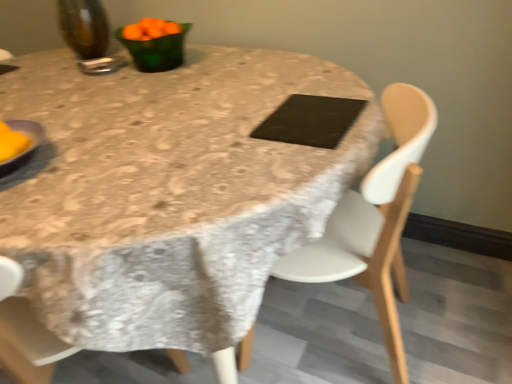
Question: From a real-world perspective, is black matte pad at center located beneath yellow matte plate at left?

Choices:
 (A) no
 (B) yes

Answer: (B)

Question: Could you tell me if black matte pad at center is turned towards yellow matte plate at left?

Choices:
 (A) yes
 (B) no

Answer: (B)

Question: Does black matte pad at center have a greater height compared to yellow matte plate at left?

Choices:
 (A) no
 (B) yes

Answer: (A)

Question: From the image's perspective, is black matte pad at center on yellow matte plate at left?

Choices:
 (A) no
 (B) yes

Answer: (B)

Question: Is black matte pad at center located outside yellow matte plate at left?

Choices:
 (A) yes
 (B) no

Answer: (A)

Question: Is black matte pad at center situated inside linen tablecloth at center or outside?

Choices:
 (A) outside
 (B) inside

Answer: (B)

Question: Is black matte pad at center bigger or smaller than linen tablecloth at center?

Choices:
 (A) big
 (B) small

Answer: (B)

Question: From the image's perspective, is black matte pad at center positioned above or below linen tablecloth at center?

Choices:
 (A) above
 (B) below

Answer: (A)

Question: Is point (357, 100) positioned closer to the camera than point (31, 69)?

Choices:
 (A) closer
 (B) farther

Answer: (A)

Question: Is yellow matte plate at left spatially inside white plastic chair at center, or outside of it?

Choices:
 (A) inside
 (B) outside

Answer: (B)

Question: Would you say yellow matte plate at left is to the left or to the right of white plastic chair at center in the picture?

Choices:
 (A) left
 (B) right

Answer: (A)

Question: Relative to white plastic chair at center, is yellow matte plate at left in front or behind?

Choices:
 (A) front
 (B) behind

Answer: (B)

Question: From a real-world perspective, is yellow matte plate at left physically located above or below white plastic chair at center?

Choices:
 (A) below
 (B) above

Answer: (B)

Question: From a real-world perspective, is black matte pad at center above or below green glass bowl at upper left, the 2th tableware when ordered from left to right?

Choices:
 (A) above
 (B) below

Answer: (B)

Question: In the image, is black matte pad at center positioned in front of or behind green glass bowl at upper left, the 2th tableware when ordered from left to right?

Choices:
 (A) front
 (B) behind

Answer: (A)